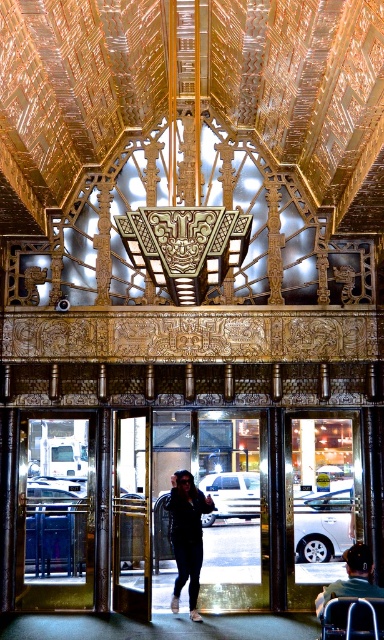
You are a visitor at the entrance of this building and want to sit down. You see the dark blue jeans at center and the dark gray fabric wheelchair at lower right. Which object is closer to the floor?

The dark gray fabric wheelchair at lower right is closer to the floor since the dark blue jeans at center is located below it.

You are standing at the entrance of a building with an ornate Art Deco design. You see a transparent glass door at left and dark blue jeans at center. How far apart are these two objects?

The transparent glass door at left is 3.67 meters away from the dark blue jeans at center.